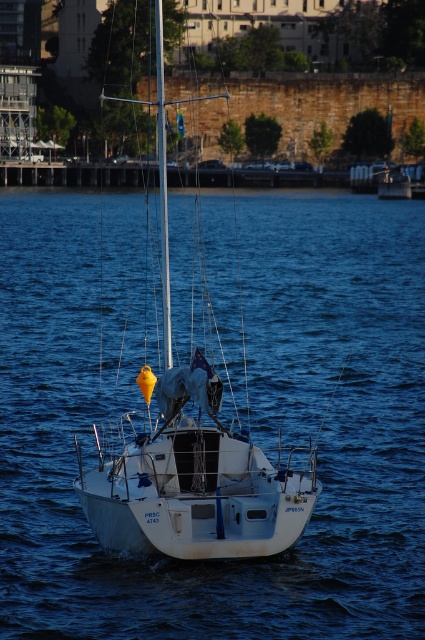
You are standing on the dock and see the white matte water at center and the white matte sailboat at center. Which object is positioned to the right of the other?

The white matte water at center is to the right of the white matte sailboat at center.

You are standing on the deck of the sailboat and want to take a photo of two points marked on the water surface. The first point is at coordinates point (175, 268) and the second is at point (102, 515). Which point will appear closer to the camera in your photo?

Point (102, 515) will appear closer to the camera in the photo because it is closer to the viewer than point (175, 268), which is further away.